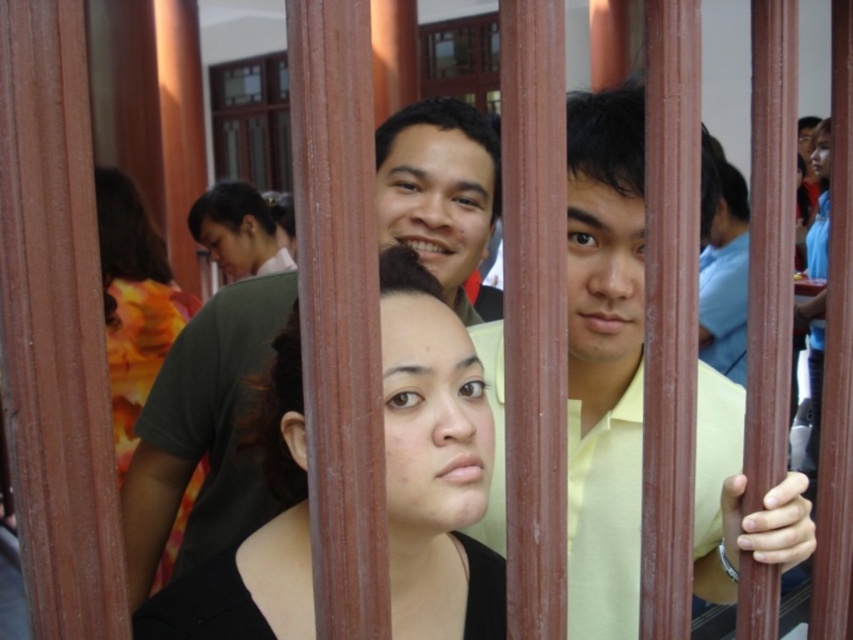
Between yellow smooth shirt at center and dark brown hair at center, which one appears on the right side from the viewer's perspective?

From the viewer's perspective, yellow smooth shirt at center appears more on the right side.

Can you confirm if yellow smooth shirt at center is shorter than dark brown hair at center?

Incorrect, yellow smooth shirt at center's height does not fall short of dark brown hair at center's.

Which is in front, point (497, 472) or point (258, 202)?

Point (497, 472) is more forward.

Locate an element on the screen. The image size is (853, 640). yellow smooth shirt at center is located at coordinates (604, 360).

Who is shorter, yellow-orange floral shirt at center-left or dark brown hair at center?

dark brown hair at center is shorter.

Looking at this image, is yellow-orange floral shirt at center-left wider than dark brown hair at center?

Indeed, yellow-orange floral shirt at center-left has a greater width compared to dark brown hair at center.

This screenshot has width=853, height=640. What do you see at coordinates (134, 304) in the screenshot?
I see `yellow-orange floral shirt at center-left` at bounding box center [134, 304].

Identify the location of yellow-orange floral shirt at center-left. Image resolution: width=853 pixels, height=640 pixels. pos(134,304).

Is yellow smooth shirt at center further to the viewer compared to black matte hair at center?

Yes.

Describe the element at coordinates (604, 360) in the screenshot. The image size is (853, 640). I see `yellow smooth shirt at center` at that location.

This screenshot has width=853, height=640. Describe the element at coordinates (604, 360) in the screenshot. I see `yellow smooth shirt at center` at that location.

Locate an element on the screen. This screenshot has height=640, width=853. yellow smooth shirt at center is located at coordinates (604, 360).